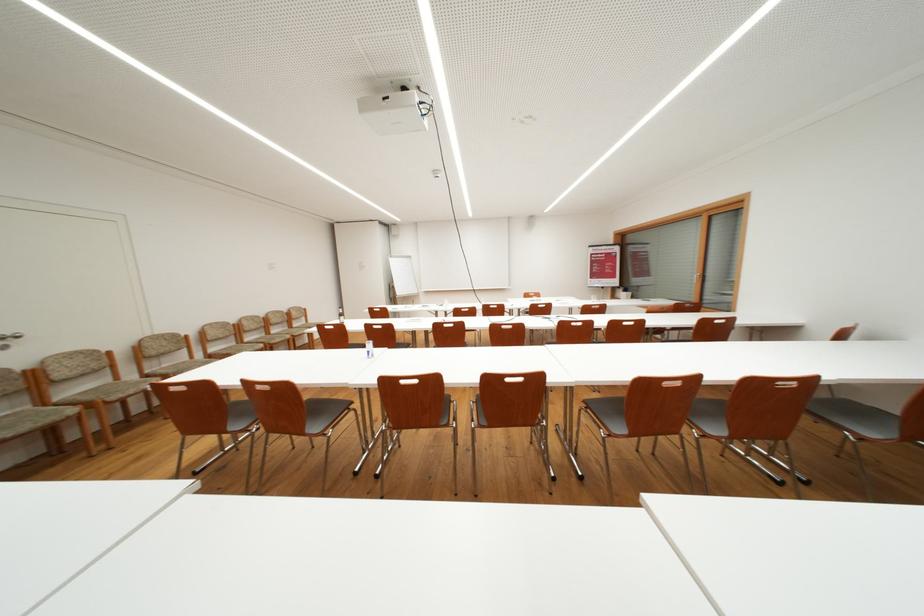
Which object does [369,349] point to?

This point indicates the small sanitizer bottle.